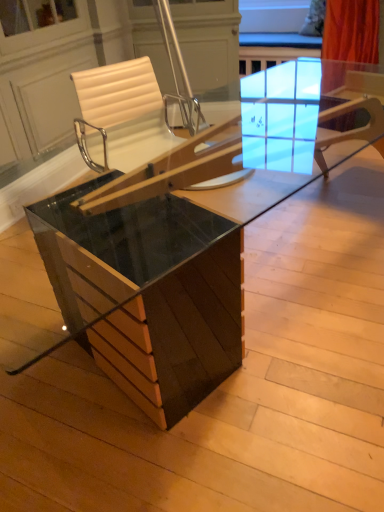
Question: From the image's perspective, relative to glossy wood table at center, is white leather chair at center above or below?

Choices:
 (A) above
 (B) below

Answer: (A)

Question: Is white leather chair at center inside the boundaries of glossy wood table at center, or outside?

Choices:
 (A) outside
 (B) inside

Answer: (A)

Question: Is white leather chair at center bigger or smaller than glossy wood table at center?

Choices:
 (A) small
 (B) big

Answer: (A)

Question: Do you think glossy wood table at center is within white leather chair at center, or outside of it?

Choices:
 (A) outside
 (B) inside

Answer: (A)

Question: From a real-world perspective, is glossy wood table at center positioned above or below white leather chair at center?

Choices:
 (A) below
 (B) above

Answer: (A)

Question: From the image's perspective, is glossy wood table at center positioned above or below white leather chair at center?

Choices:
 (A) below
 (B) above

Answer: (A)

Question: Looking at their shapes, would you say glossy wood table at center is wider or thinner than white leather chair at center?

Choices:
 (A) wide
 (B) thin

Answer: (A)